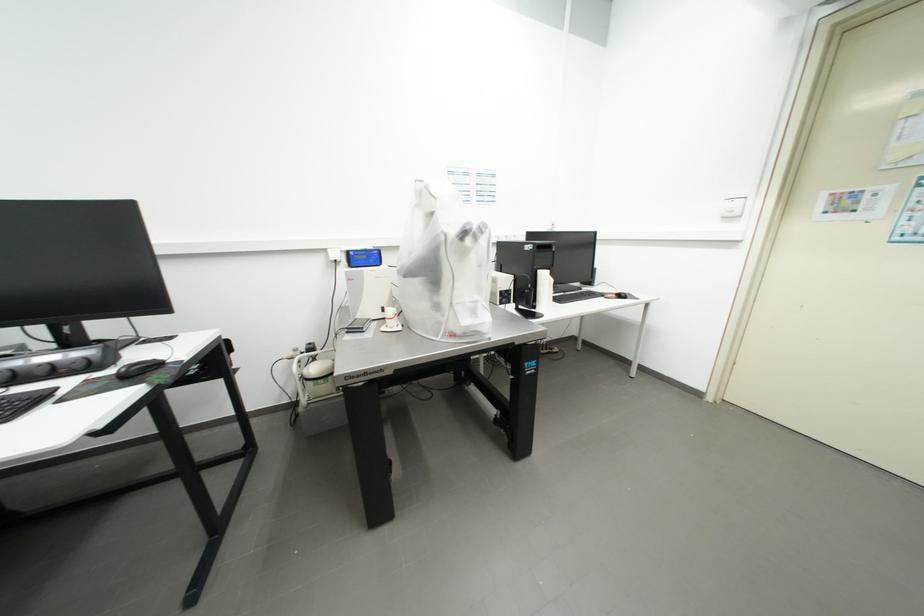
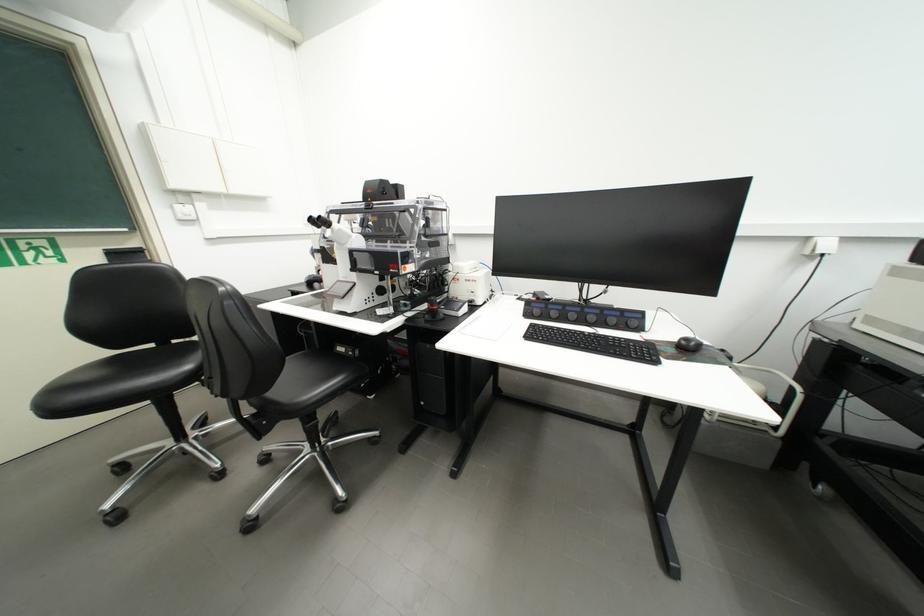
Find the pixel in the second image that matches point (148, 376) in the first image.

(697, 351)